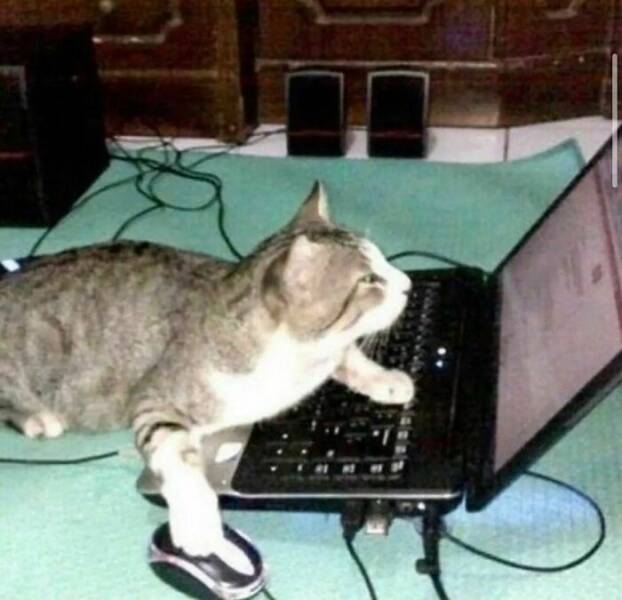
The width and height of the screenshot is (622, 600). What are the coordinates of `laptop charger` in the screenshot? It's located at (429, 536).